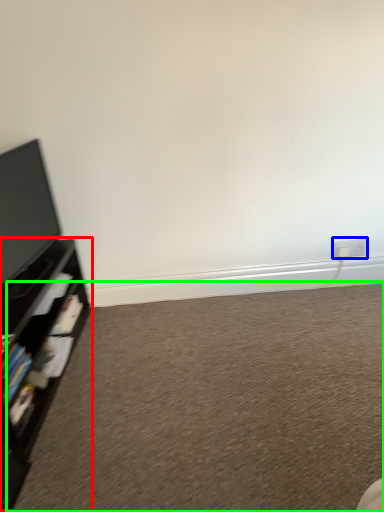
Question: Based on their relative distances, which object is farther from shelf (highlighted by a red box)? Choose from electric outlet (highlighted by a blue box) and plain (highlighted by a green box).

Choices:
 (A) electric outlet
 (B) plain

Answer: (A)